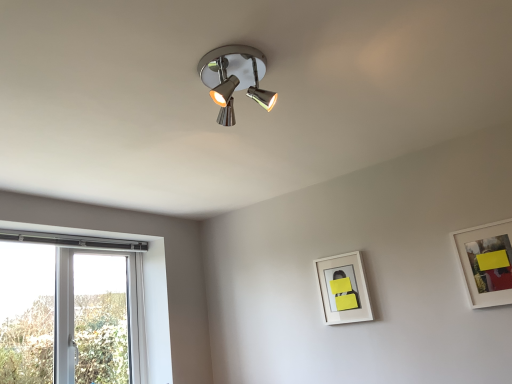
Question: Is point (336, 321) positioned closer to the camera than point (470, 286)?

Choices:
 (A) closer
 (B) farther

Answer: (B)

Question: Is white matte picture frame at lower right, arranged as the first picture frame when viewed from the left, bigger or smaller than white matte picture frame at upper right, positioned as the second picture frame in back-to-front order?

Choices:
 (A) big
 (B) small

Answer: (B)

Question: From a real-world perspective, is white matte picture frame at lower right, the first picture frame viewed from the back, physically located above or below white matte picture frame at upper right, which is counted as the second picture frame, starting from the left?

Choices:
 (A) below
 (B) above

Answer: (B)

Question: Based on their sizes in the image, would you say white matte picture frame at upper right, which is counted as the second picture frame, starting from the left, is bigger or smaller than white matte picture frame at lower right, positioned as the 2th picture frame in right-to-left order?

Choices:
 (A) big
 (B) small

Answer: (A)

Question: Is white matte picture frame at upper right, which ranks as the 1th picture frame in right-to-left order, in front of or behind white matte picture frame at lower right, the first picture frame viewed from the back, in the image?

Choices:
 (A) behind
 (B) front

Answer: (B)

Question: From the image's perspective, is white matte picture frame at upper right, positioned as the second picture frame in back-to-front order, above or below white matte picture frame at lower right, positioned as the 2th picture frame in right-to-left order?

Choices:
 (A) above
 (B) below

Answer: (A)

Question: From a real-world perspective, is white matte picture frame at upper right, which ranks as the 1th picture frame in right-to-left order, physically located above or below white matte picture frame at lower right, positioned as the 2th picture frame in right-to-left order?

Choices:
 (A) above
 (B) below

Answer: (B)